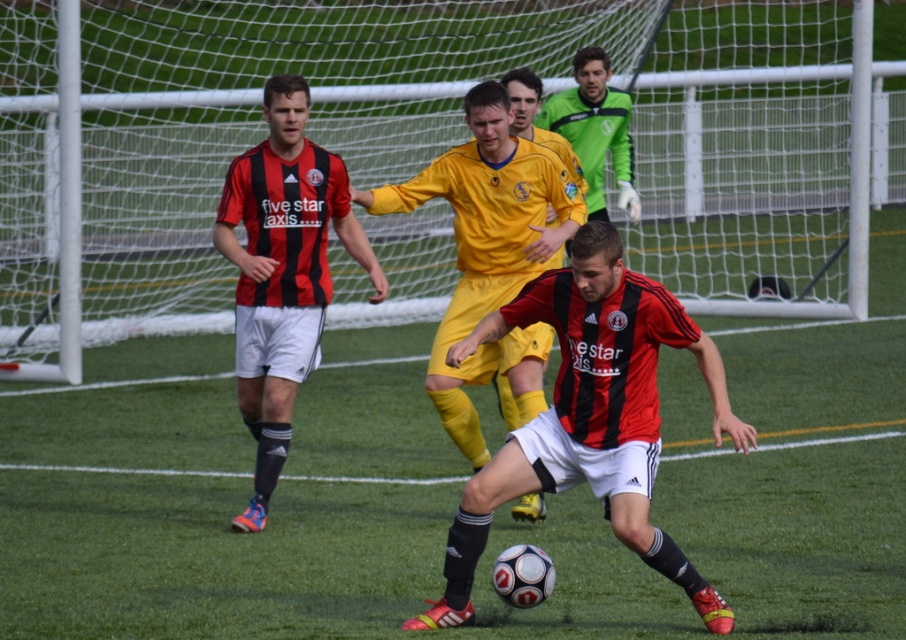
Who is shorter, white mesh net at center or green matte jersey at upper center?

green matte jersey at upper center is shorter.

Who is positioned more to the right, white mesh net at center or green matte jersey at upper center?

Positioned to the right is green matte jersey at upper center.

Describe the element at coordinates (429, 145) in the screenshot. I see `white mesh net at center` at that location.

Find the location of `white mesh net at center`. white mesh net at center is located at coordinates (429, 145).

Can you confirm if white mesh net at center is smaller than matte black jersey at center?

No.

Based on the photo, can you confirm if white mesh net at center is positioned below matte black jersey at center?

Incorrect, white mesh net at center is not positioned below matte black jersey at center.

Which is in front, point (503, 16) or point (321, 179)?

Point (321, 179) is more forward.

Where is `white mesh net at center`? This screenshot has width=906, height=640. white mesh net at center is located at coordinates (429, 145).

Consider the image. Which of these two, matte black soccer player at center or yellow matte jersey at center, stands taller?

Standing taller between the two is yellow matte jersey at center.

Between point (644, 513) and point (442, 381), which one is positioned behind?

Point (442, 381)

Identify the location of matte black soccer player at center. (590, 417).